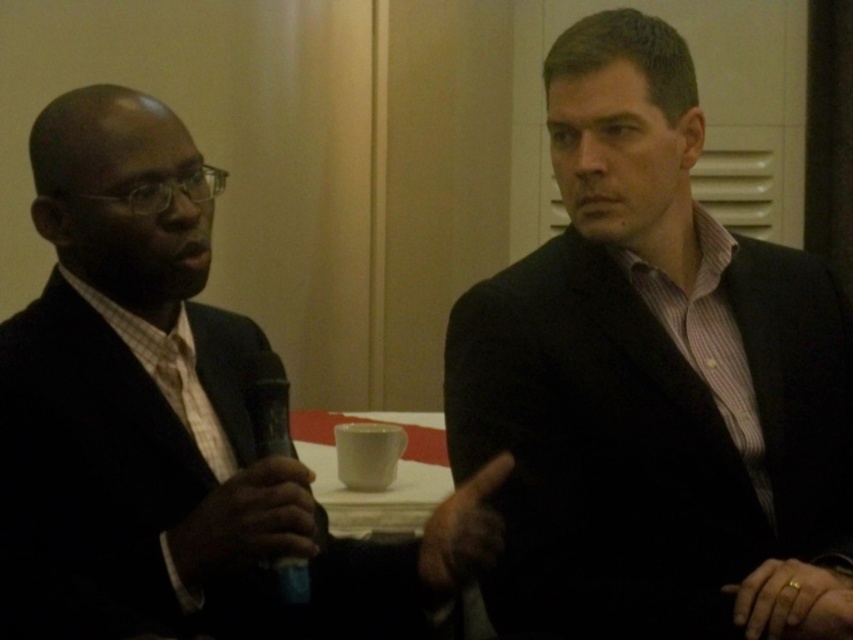
You are attending a virtual meeting and need to determine which of the two points, point [482,499] or point [178,412], is closer to you in the scene. Based on the image, which point is nearer?

Point [482,499] is closer to the viewer than point [178,412].

Based on the scene description, where exactly is the matte black suit at center located in terms of coordinates?

The matte black suit at center is located at coordinates point (648, 372).

You are a photographer trying to capture a closeup of the brown leather hand at center during a live event. The camera you are using has a minimum focusing distance of 3 feet. Can you take the closeup without moving the camera or the hand?

The brown leather hand at center and camera are 3.40 feet apart, so yes, the photographer can take the closeup because the distance is within the camera minimum focusing distance of 3 feet.